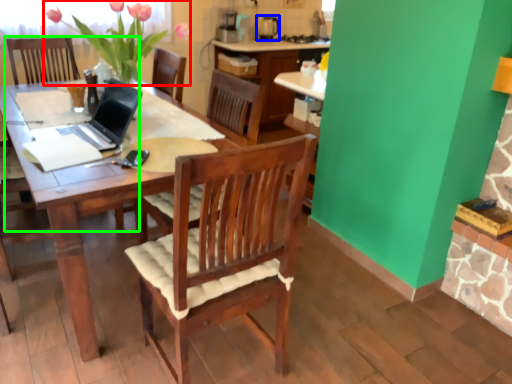
Question: Which is farther away from floral arrangement (highlighted by a red box)? appliance (highlighted by a blue box) or armchair (highlighted by a green box)?

Choices:
 (A) appliance
 (B) armchair

Answer: (A)